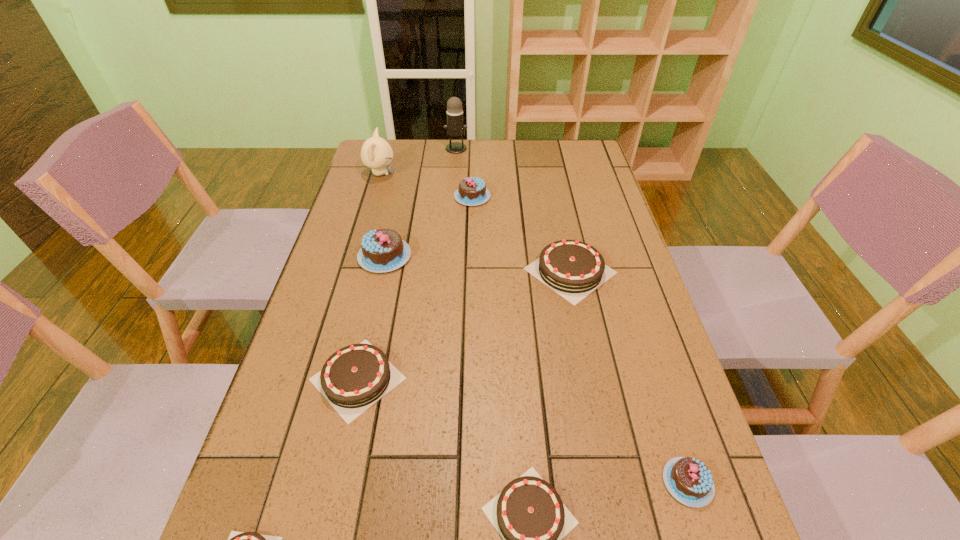
The height and width of the screenshot is (540, 960). I want to click on microphone at the far edge, so click(x=455, y=128).

Where is `kitten that is positioned at the far edge`? This screenshot has width=960, height=540. kitten that is positioned at the far edge is located at coordinates (376, 153).

Locate an element on the screen. Image resolution: width=960 pixels, height=540 pixels. kitten at the left edge is located at coordinates (376, 153).

Image resolution: width=960 pixels, height=540 pixels. I want to click on object situated at the far left corner, so click(376, 153).

Where is `free region at the far edge of the desktop`? The width and height of the screenshot is (960, 540). free region at the far edge of the desktop is located at coordinates (502, 143).

You are a GUI agent. You are given a task and a screenshot of the screen. Output one action in this format:
    pyautogui.click(x=<x>, y=<y>)
    Task: Click on the vacant space at the left edge of the desktop
    This screenshot has width=960, height=540.
    Given the screenshot: What is the action you would take?
    pyautogui.click(x=387, y=184)

The image size is (960, 540). What are the coordinates of `vacant space at the right edge of the desktop` in the screenshot? It's located at (613, 200).

The height and width of the screenshot is (540, 960). Identify the location of free space at the far right corner of the desktop. (558, 145).

The width and height of the screenshot is (960, 540). Find the location of `free space between the nearest pink chocolate cake and the biggest brown chocolate cake`. free space between the nearest pink chocolate cake and the biggest brown chocolate cake is located at coordinates (629, 376).

Where is `free point between the farthest brown chocolate cake and the smallest pink chocolate cake`? This screenshot has height=540, width=960. free point between the farthest brown chocolate cake and the smallest pink chocolate cake is located at coordinates (629, 376).